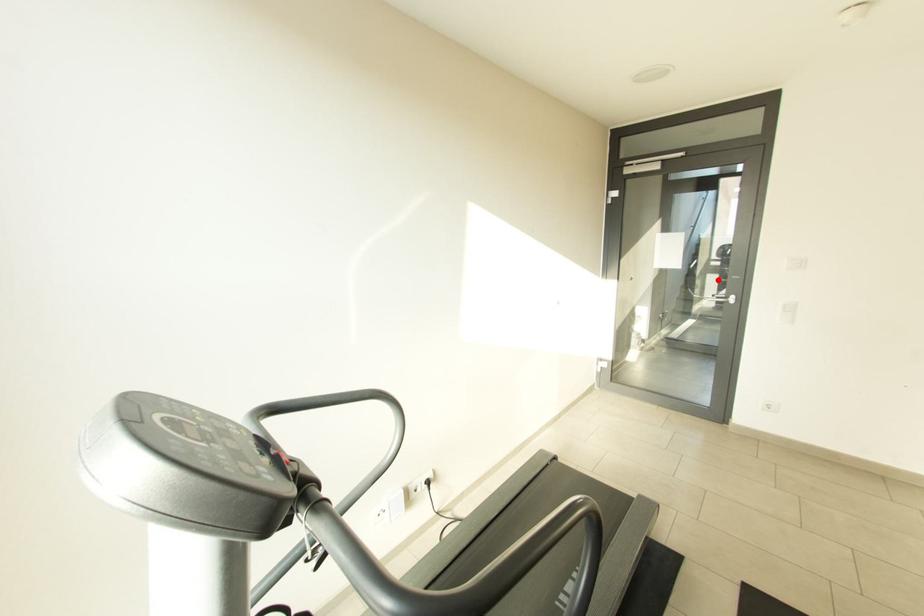
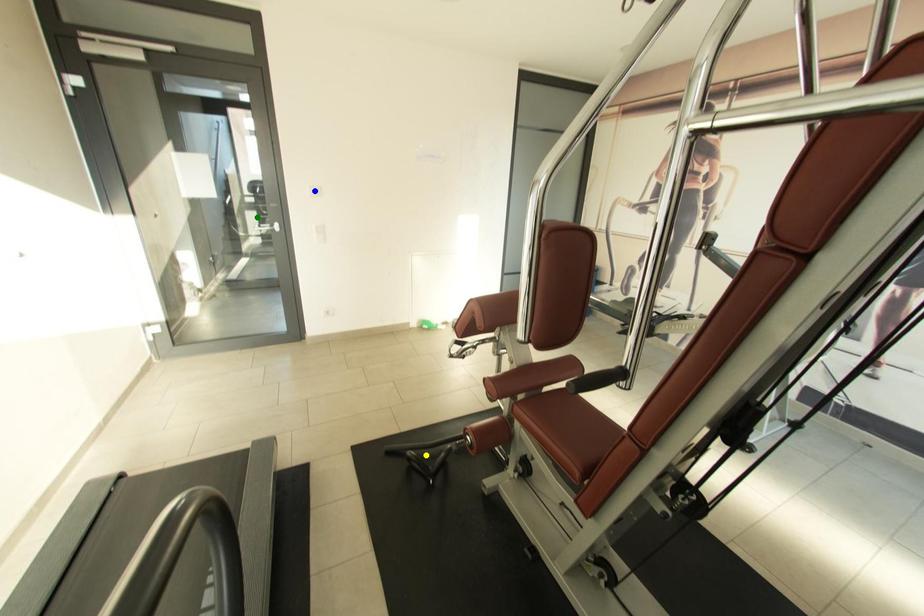
Question: I am providing you with two images of the same scene from different viewpoints. A red point is marked on the first image. You are given multiple points on the second image. Which point in image 2 represents the same 3d spot as the red point in image 1?

Choices:
 (A) green point
 (B) blue point
 (C) yellow point

Answer: (A)